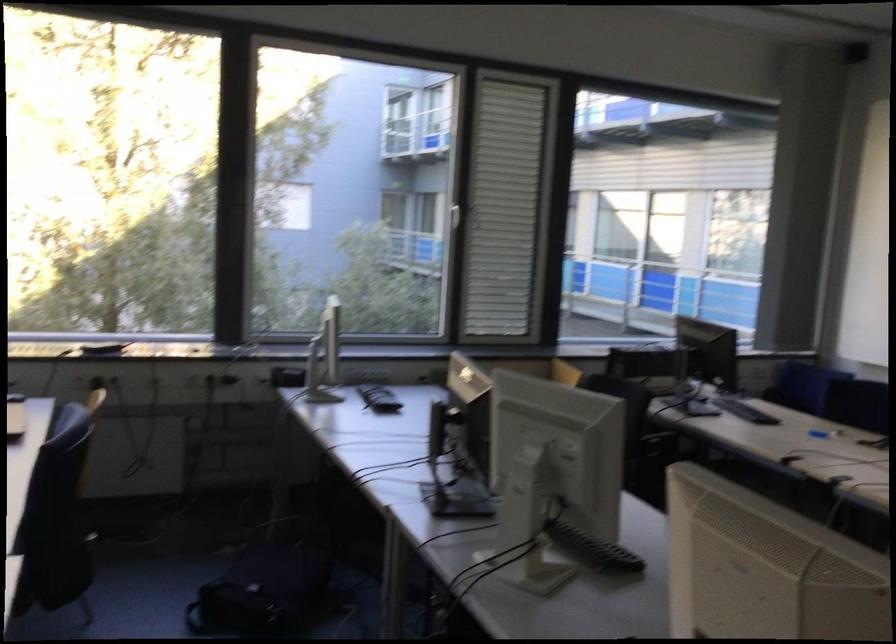
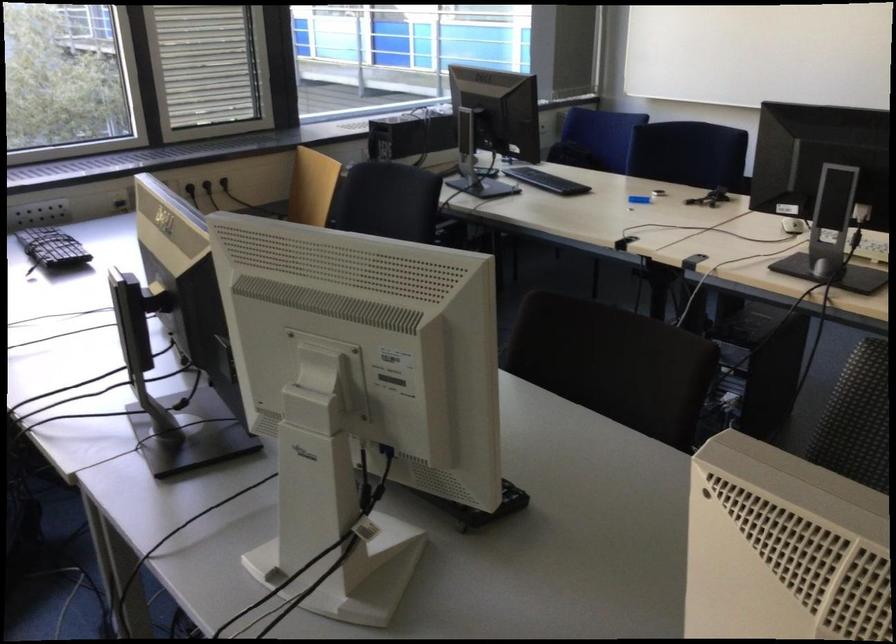
In the second image, find the point that corresponds to (803,379) in the first image.

(596, 138)